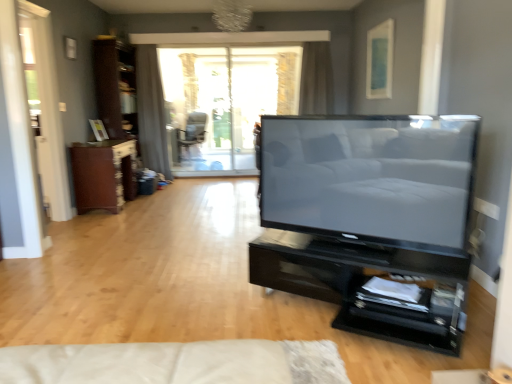
Question: Considering the relative sizes of white glossy screen door at left and matte black chair at center in the image provided, is white glossy screen door at left smaller than matte black chair at center?

Choices:
 (A) yes
 (B) no

Answer: (A)

Question: Can you confirm if white glossy screen door at left is taller than matte black chair at center?

Choices:
 (A) yes
 (B) no

Answer: (A)

Question: Is white glossy screen door at left at the left side of matte black chair at center?

Choices:
 (A) no
 (B) yes

Answer: (B)

Question: Could you tell me if white glossy screen door at left is facing matte black chair at center?

Choices:
 (A) yes
 (B) no

Answer: (B)

Question: Considering the relative positions of white glossy screen door at left and matte black chair at center in the image provided, is white glossy screen door at left in front of matte black chair at center?

Choices:
 (A) yes
 (B) no

Answer: (A)

Question: From their relative heights in the image, would you say satin gray curtain at upper center, the first curtain positioned from the right, is taller or shorter than white glossy screen door at left?

Choices:
 (A) tall
 (B) short

Answer: (B)

Question: From a real-world perspective, is satin gray curtain at upper center, the first curtain positioned from the right, above or below white glossy screen door at left?

Choices:
 (A) above
 (B) below

Answer: (A)

Question: In the image, is satin gray curtain at upper center, placed as the second curtain when sorted from left to right, positioned in front of or behind white glossy screen door at left?

Choices:
 (A) front
 (B) behind

Answer: (B)

Question: Do you think satin gray curtain at upper center, placed as the second curtain when sorted from left to right, is within white glossy screen door at left, or outside of it?

Choices:
 (A) inside
 (B) outside

Answer: (B)

Question: Is transparent glass window at center situated inside gray fabric curtain at upper center, the first curtain when ordered from left to right, or outside?

Choices:
 (A) inside
 (B) outside

Answer: (B)

Question: Considering the positions of transparent glass window at center and gray fabric curtain at upper center, the first curtain when ordered from left to right, in the image, is transparent glass window at center taller or shorter than gray fabric curtain at upper center, the first curtain when ordered from left to right,?

Choices:
 (A) tall
 (B) short

Answer: (A)

Question: Looking at their shapes, would you say transparent glass window at center is wider or thinner than gray fabric curtain at upper center, positioned as the 2th curtain in right-to-left order?

Choices:
 (A) thin
 (B) wide

Answer: (A)

Question: From a real-world perspective, relative to gray fabric curtain at upper center, positioned as the 2th curtain in right-to-left order, is transparent glass window at center vertically above or below?

Choices:
 (A) above
 (B) below

Answer: (A)

Question: Considering their positions, is matte black chair at center located in front of or behind matte black tv at center?

Choices:
 (A) front
 (B) behind

Answer: (B)

Question: Is matte black chair at center bigger or smaller than matte black tv at center?

Choices:
 (A) small
 (B) big

Answer: (B)